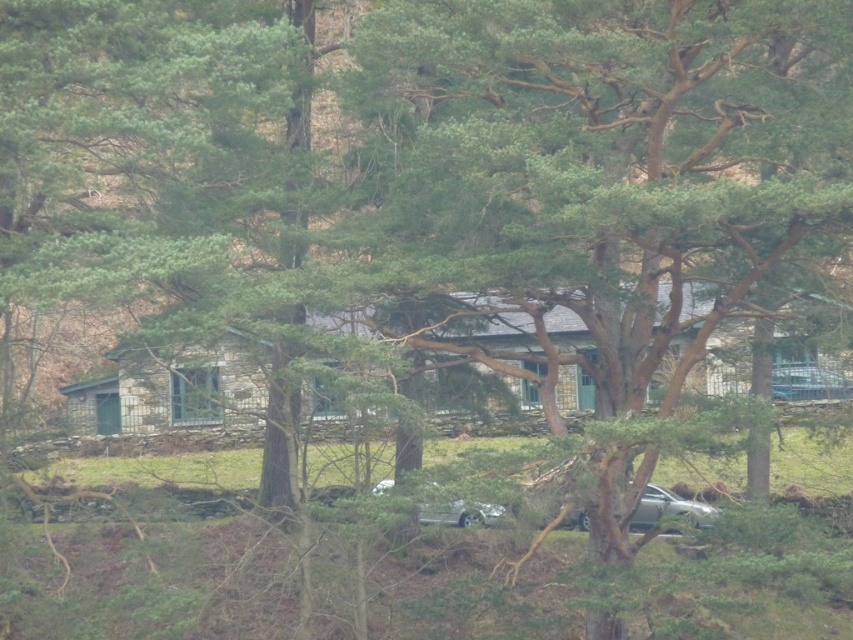
Measure the distance between point (561, 524) and camera.

Point (561, 524) is 40.48 meters from camera.

Is silver metallic car at lower center positioned in front of metallic silver car at center?

No, it is not.

Where is `silver metallic car at lower center`? silver metallic car at lower center is located at coordinates (669, 508).